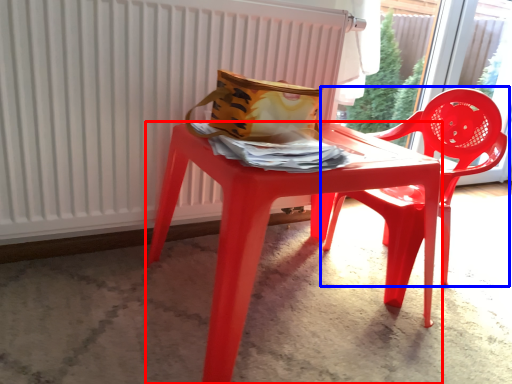
Question: Which object is closer to the camera taking this photo, table (highlighted by a red box) or chair (highlighted by a blue box)?

Choices:
 (A) table
 (B) chair

Answer: (A)